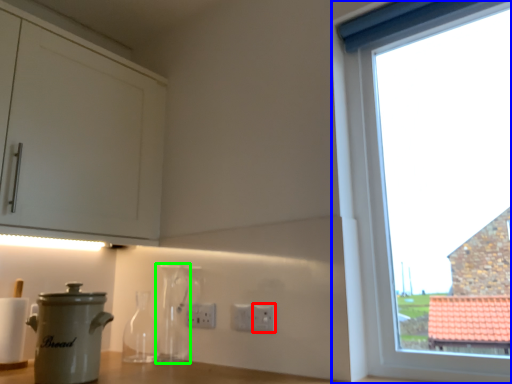
Question: Based on their relative distances, which object is nearer to electric outlet (highlighted by a red box)? Choose from window (highlighted by a blue box) and bottle (highlighted by a green box).

Choices:
 (A) window
 (B) bottle

Answer: (B)